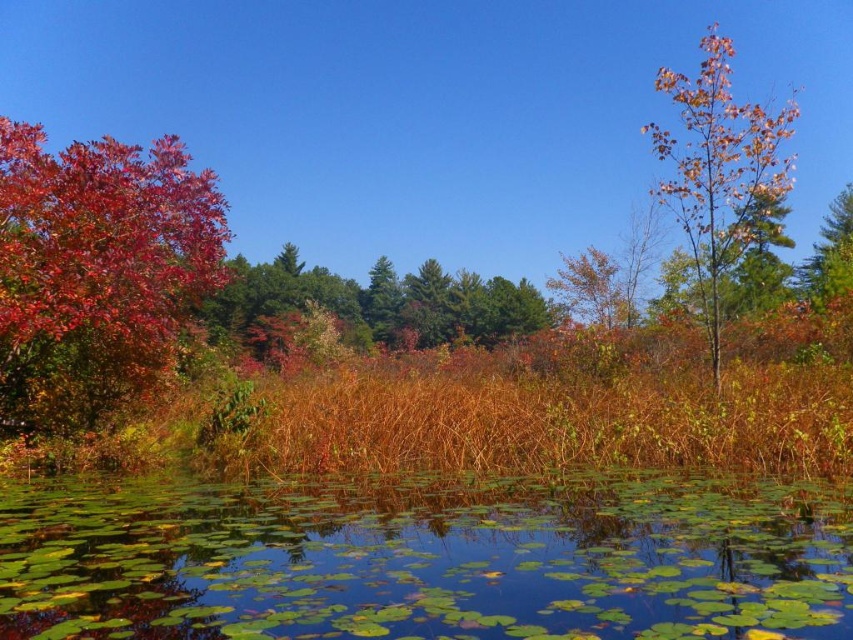
Question: Which point appears closest to the camera in this image?

Choices:
 (A) (160, 275)
 (B) (503, 307)
 (C) (827, 401)
 (D) (753, 188)

Answer: (C)

Question: Which object appears farthest from the camera in this image?

Choices:
 (A) green matte tree at upper right
 (B) autumn leaves at center

Answer: (A)

Question: Observing the image, what is the correct spatial positioning of shiny red leaves at left in reference to autumn leaves at center?

Choices:
 (A) above
 (B) below

Answer: (B)

Question: Can you confirm if green leafy water at bottom is smaller than brown grass at center?

Choices:
 (A) yes
 (B) no

Answer: (A)

Question: Considering the real-world distances, which object is farthest from the brown grass at center?

Choices:
 (A) orange-brown bark tree at upper right
 (B) red matte tree at left

Answer: (A)

Question: Can you confirm if brown grass at center is wider than green matte tree at upper right?

Choices:
 (A) no
 (B) yes

Answer: (A)